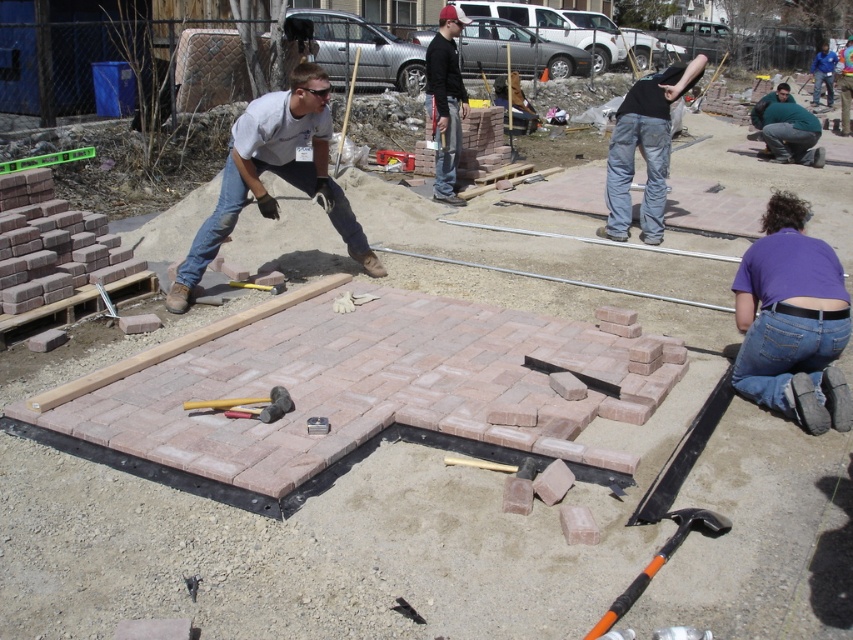
Based on the coordinates provided in the image, where is the purple cotton shirt at lower right located?

The purple cotton shirt at lower right is located at the 2D coordinates point (792, 321).

You are a construction worker who needs to hand a tool to the matte black shirt at upper center and the fat man at lower right. Which one should you approach first if you want to give the tool to the person who is closer to you?

The matte black shirt at upper center is to the left of fat man at lower right, so depending on your position, if you are on the right side of the fat man at lower right, you might need to move less to reach them. However, since the exact positions aren not fully described, the closest would depend on your starting point. But based on the given spatial relation, the matte black shirt at upper center is positioned to the left of the fat man at lower right, so if you are in the middle, the matte black shirt 1